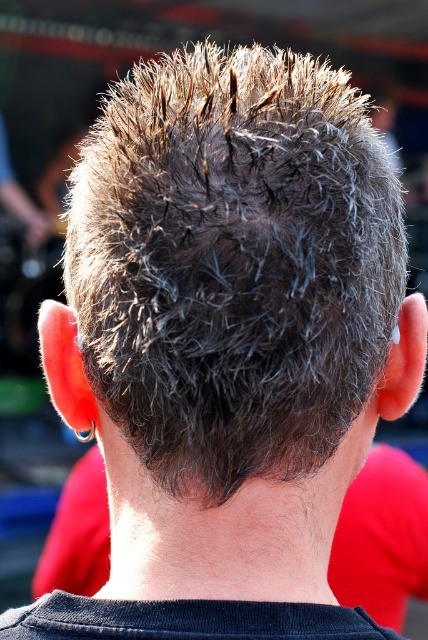
Question: Which point is farther to the camera?

Choices:
 (A) (169, 465)
 (B) (389, 493)

Answer: (B)

Question: Can you confirm if dark brown spiky hair at center is wider than dark gray hair at center?

Choices:
 (A) yes
 (B) no

Answer: (B)

Question: Is dark brown spiky hair at center behind dark gray hair at center?

Choices:
 (A) yes
 (B) no

Answer: (B)

Question: Does dark brown spiky hair at center appear over dark gray hair at center?

Choices:
 (A) yes
 (B) no

Answer: (A)

Question: Which point is closer to the camera?

Choices:
 (A) (243, 278)
 (B) (386, 572)

Answer: (A)